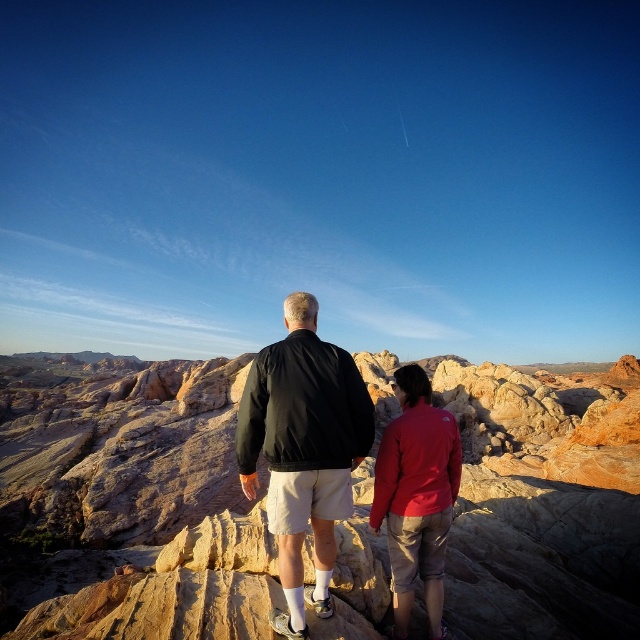
Question: Is black matte jacket at center below matte red jacket at center?

Choices:
 (A) no
 (B) yes

Answer: (A)

Question: Which point appears farthest from the camera in this image?

Choices:
 (A) (268, 355)
 (B) (424, 476)

Answer: (A)

Question: Is black matte jacket at center to the left of matte red jacket at center from the viewer's perspective?

Choices:
 (A) no
 (B) yes

Answer: (B)

Question: Which of the following is the farthest from the observer?

Choices:
 (A) black matte jacket at center
 (B) matte red jacket at center

Answer: (B)

Question: Which point is closer to the camera?

Choices:
 (A) black matte jacket at center
 (B) matte red jacket at center

Answer: (A)

Question: Does black matte jacket at center appear over matte red jacket at center?

Choices:
 (A) no
 (B) yes

Answer: (B)